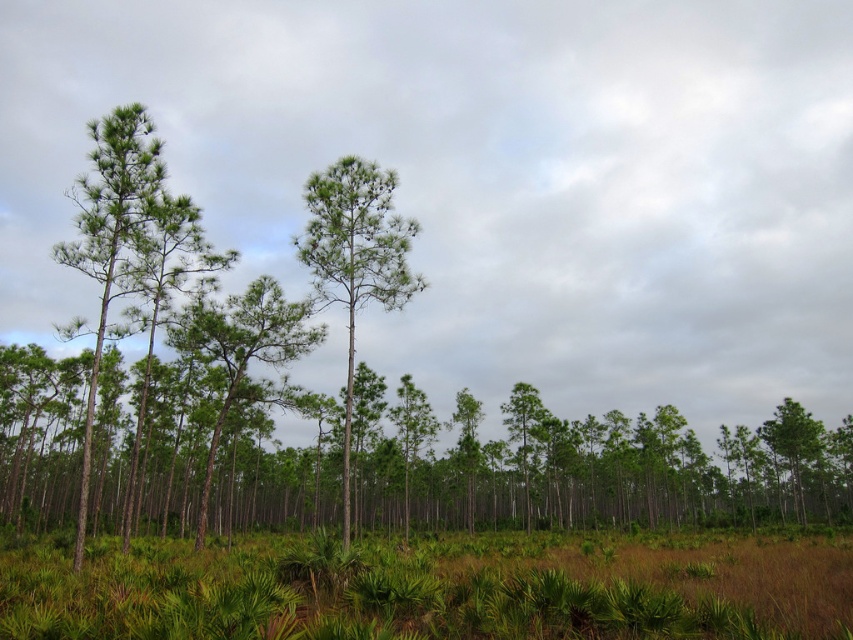
Question: Does green leafy grass at lower center have a smaller size compared to green matte tree at center?

Choices:
 (A) no
 (B) yes

Answer: (B)

Question: Is green leafy grass at lower center to the left of green matte tree at center from the viewer's perspective?

Choices:
 (A) no
 (B) yes

Answer: (A)

Question: Among these objects, which one is nearest to the camera?

Choices:
 (A) green leafy grass at lower center
 (B) green matte tree at center

Answer: (A)

Question: Which point appears closest to the camera in this image?

Choices:
 (A) (390, 170)
 (B) (190, 636)

Answer: (B)

Question: Does green leafy grass at lower center appear on the right side of green matte tree at center?

Choices:
 (A) no
 (B) yes

Answer: (B)